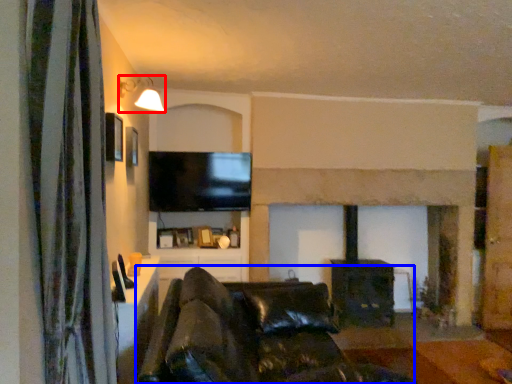
Question: Which of the following is the closest to the observer, light fixture (highlighted by a red box) or studio couch (highlighted by a blue box)?

Choices:
 (A) light fixture
 (B) studio couch

Answer: (B)